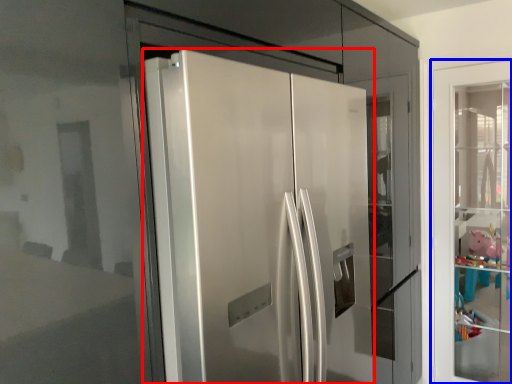
Question: Among these objects, which one is nearest to the camera, door (highlighted by a red box) or door (highlighted by a blue box)?

Choices:
 (A) door
 (B) door

Answer: (A)